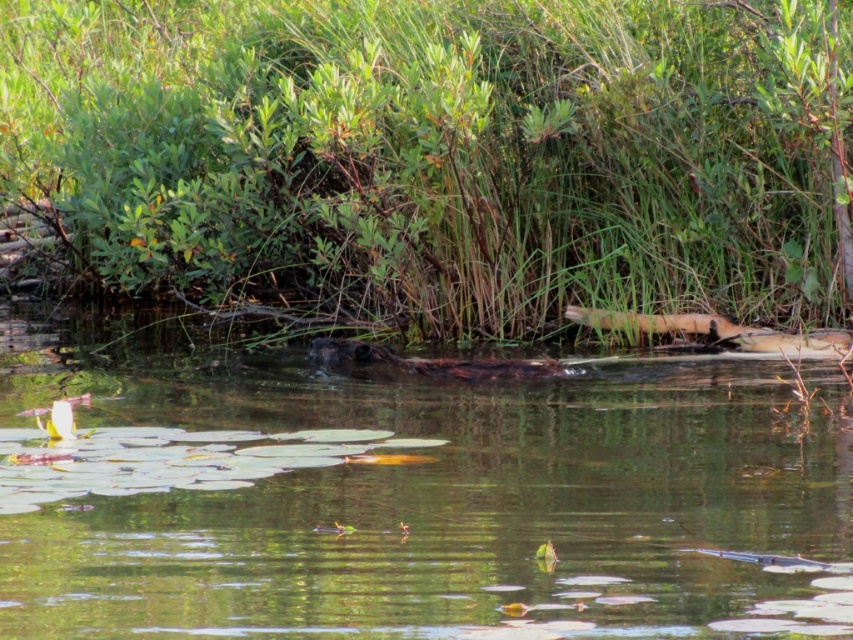
Question: In this image, where is green leafy shrubs at center located relative to brown furry beaver at center?

Choices:
 (A) below
 (B) above

Answer: (B)

Question: Which object is farther from the camera taking this photo?

Choices:
 (A) brown furry beaver at center
 (B) green leafy shrubs at center

Answer: (B)

Question: Can you confirm if green leafy shrubs at center is positioned to the left of brown furry beaver at center?

Choices:
 (A) yes
 (B) no

Answer: (A)

Question: Which point is closer to the camera?

Choices:
 (A) pos(132,234)
 (B) pos(289,480)

Answer: (B)

Question: Does green leafy shrubs at center have a larger size compared to brown furry beaver at center?

Choices:
 (A) yes
 (B) no

Answer: (A)